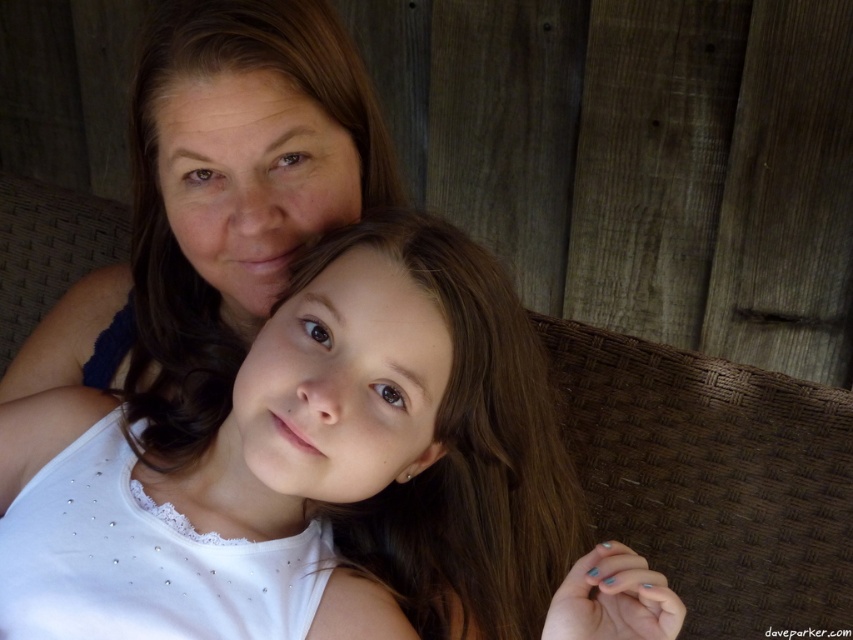
Between point (236, 388) and point (229, 243), which one is positioned in front?

Point (236, 388)

Is white satin blouse at center further to camera compared to matte blue tank top at upper left?

No, white satin blouse at center is closer to the viewer.

Between point (292, 288) and point (154, 19), which one is positioned in front?

Point (292, 288) is in front.

I want to click on white satin blouse at center, so click(x=320, y=474).